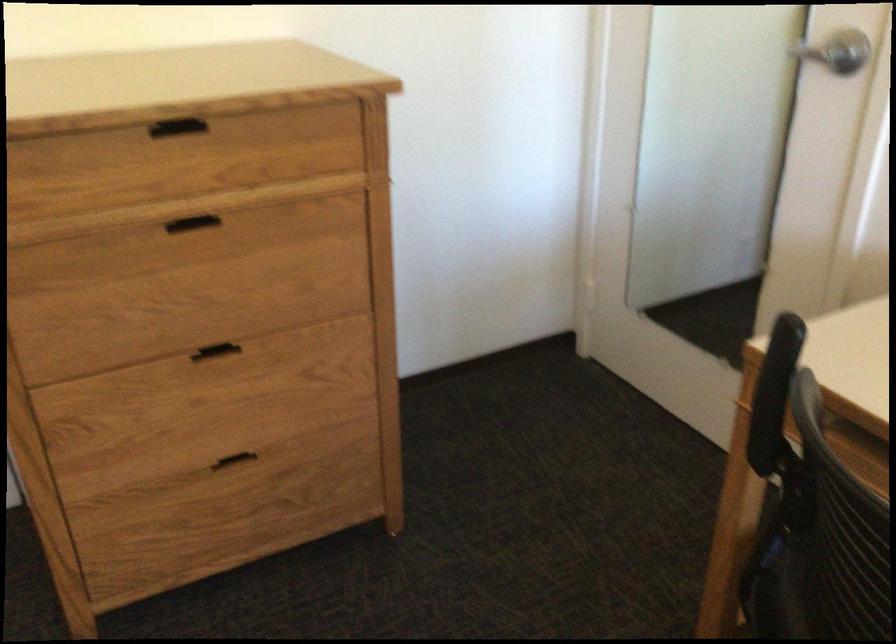
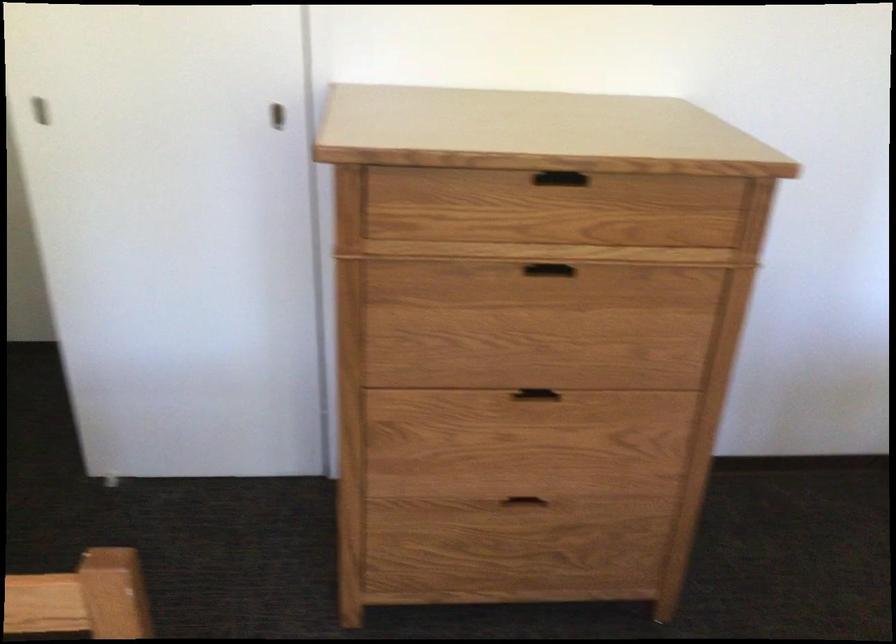
In the second image, find the point that corresponds to the point at 177,128 in the first image.

(549, 167)